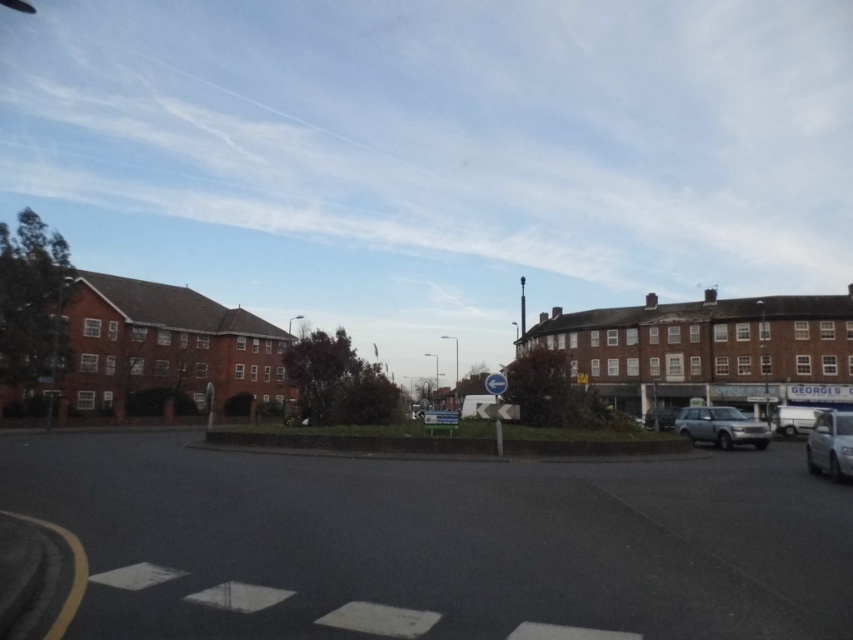
Question: Which of the following is the farthest from the observer?

Choices:
 (A) silver metallic suv at center-right
 (B) silver metallic car at right
 (C) dark asphalt road at center

Answer: (A)

Question: Can you confirm if silver metallic suv at center-right is smaller than silver metallic car at right?

Choices:
 (A) no
 (B) yes

Answer: (B)

Question: Which point appears farthest from the camera in this image?

Choices:
 (A) (846, 449)
 (B) (764, 428)
 (C) (321, 632)

Answer: (B)

Question: Which point is farther from the camera taking this photo?

Choices:
 (A) (772, 486)
 (B) (698, 429)
 (C) (842, 449)

Answer: (B)

Question: Is dark asphalt road at center positioned behind silver metallic car at right?

Choices:
 (A) no
 (B) yes

Answer: (A)

Question: Does silver metallic suv at center-right have a lesser width compared to silver metallic car at right?

Choices:
 (A) yes
 (B) no

Answer: (A)